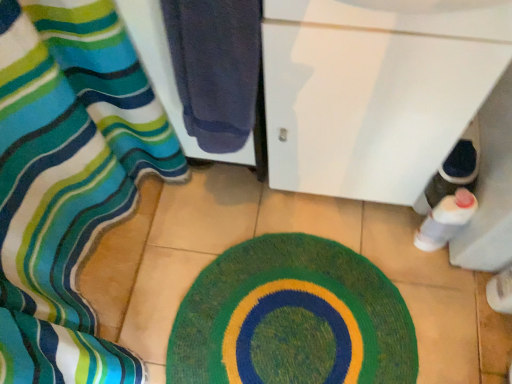
Question: Is silky striped fabric at left wider than green knitted bath mat at center?

Choices:
 (A) yes
 (B) no

Answer: (A)

Question: Is silky striped fabric at left facing away from green knitted bath mat at center?

Choices:
 (A) yes
 (B) no

Answer: (B)

Question: Is silky striped fabric at left taller than green knitted bath mat at center?

Choices:
 (A) yes
 (B) no

Answer: (B)

Question: Can green knitted bath mat at center be found inside silky striped fabric at left?

Choices:
 (A) no
 (B) yes

Answer: (A)

Question: From the image's perspective, is silky striped fabric at left beneath green knitted bath mat at center?

Choices:
 (A) yes
 (B) no

Answer: (B)

Question: From the image's perspective, relative to dark blue towel at left, is silky striped fabric at left above or below?

Choices:
 (A) below
 (B) above

Answer: (A)

Question: From a real-world perspective, is silky striped fabric at left physically located above or below dark blue towel at left?

Choices:
 (A) below
 (B) above

Answer: (A)

Question: Based on their sizes in the image, would you say silky striped fabric at left is bigger or smaller than dark blue towel at left?

Choices:
 (A) big
 (B) small

Answer: (B)

Question: From their relative heights in the image, would you say silky striped fabric at left is taller or shorter than dark blue towel at left?

Choices:
 (A) short
 (B) tall

Answer: (A)

Question: From a real-world perspective, is dark blue towel at left positioned above or below silky striped fabric at left?

Choices:
 (A) below
 (B) above

Answer: (B)

Question: Based on their positions, is dark blue towel at left located to the left or right of silky striped fabric at left?

Choices:
 (A) left
 (B) right

Answer: (B)

Question: Considering the positions of dark blue towel at left and silky striped fabric at left in the image, is dark blue towel at left taller or shorter than silky striped fabric at left?

Choices:
 (A) tall
 (B) short

Answer: (A)

Question: Looking at their shapes, would you say dark blue towel at left is wider or thinner than silky striped fabric at left?

Choices:
 (A) thin
 (B) wide

Answer: (A)

Question: Does point (433, 236) appear closer or farther from the camera than point (117, 193)?

Choices:
 (A) closer
 (B) farther

Answer: (A)

Question: Would you say white glossy bottle at lower right is to the left or to the right of silky striped fabric at left in the picture?

Choices:
 (A) left
 (B) right

Answer: (B)